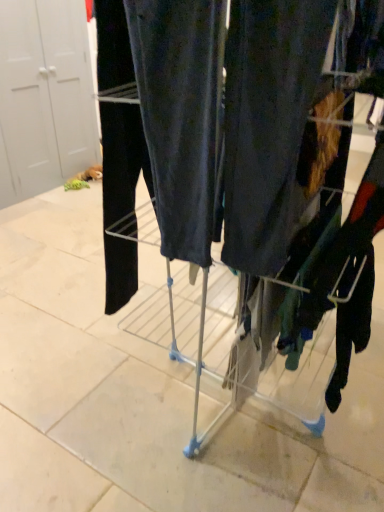
Question: Considering the relative sizes of metallic silver trolley at center and white matte door at left in the image provided, is metallic silver trolley at center thinner than white matte door at left?

Choices:
 (A) no
 (B) yes

Answer: (A)

Question: Is metallic silver trolley at center taller than white matte door at left?

Choices:
 (A) no
 (B) yes

Answer: (A)

Question: Considering the relative sizes of metallic silver trolley at center and white matte door at left in the image provided, is metallic silver trolley at center shorter than white matte door at left?

Choices:
 (A) no
 (B) yes

Answer: (B)

Question: From a real-world perspective, is metallic silver trolley at center positioned over white matte door at left based on gravity?

Choices:
 (A) yes
 (B) no

Answer: (B)

Question: Is metallic silver trolley at center bigger than white matte door at left?

Choices:
 (A) no
 (B) yes

Answer: (A)

Question: Is metallic silver trolley at center facing away from white matte door at left?

Choices:
 (A) no
 (B) yes

Answer: (A)

Question: Could you tell me if white matte door at left is turned towards metallic silver trolley at center?

Choices:
 (A) yes
 (B) no

Answer: (A)

Question: Does white matte door at left have a smaller size compared to metallic silver trolley at center?

Choices:
 (A) yes
 (B) no

Answer: (B)

Question: Is white matte door at left at the left side of metallic silver trolley at center?

Choices:
 (A) yes
 (B) no

Answer: (A)

Question: Is white matte door at left not inside metallic silver trolley at center?

Choices:
 (A) no
 (B) yes

Answer: (B)

Question: From the image's perspective, would you say white matte door at left is shown under metallic silver trolley at center?

Choices:
 (A) yes
 (B) no

Answer: (B)

Question: Is white matte door at left facing away from metallic silver trolley at center?

Choices:
 (A) no
 (B) yes

Answer: (A)

Question: Would you say metallic silver trolley at center is inside or outside white matte door at left?

Choices:
 (A) inside
 (B) outside

Answer: (B)